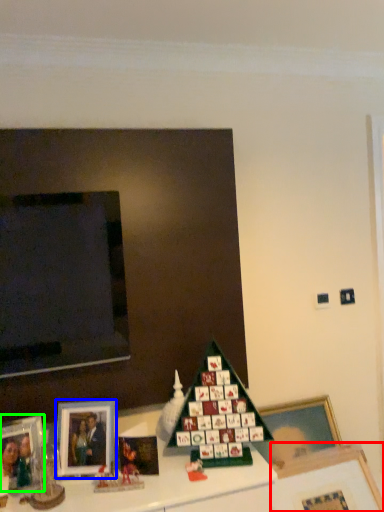
Question: Considering the real-world distances, which object is farthest from picture frame (highlighted by a red box)? picture frame (highlighted by a blue box) or picture frame (highlighted by a green box)?

Choices:
 (A) picture frame
 (B) picture frame

Answer: (B)